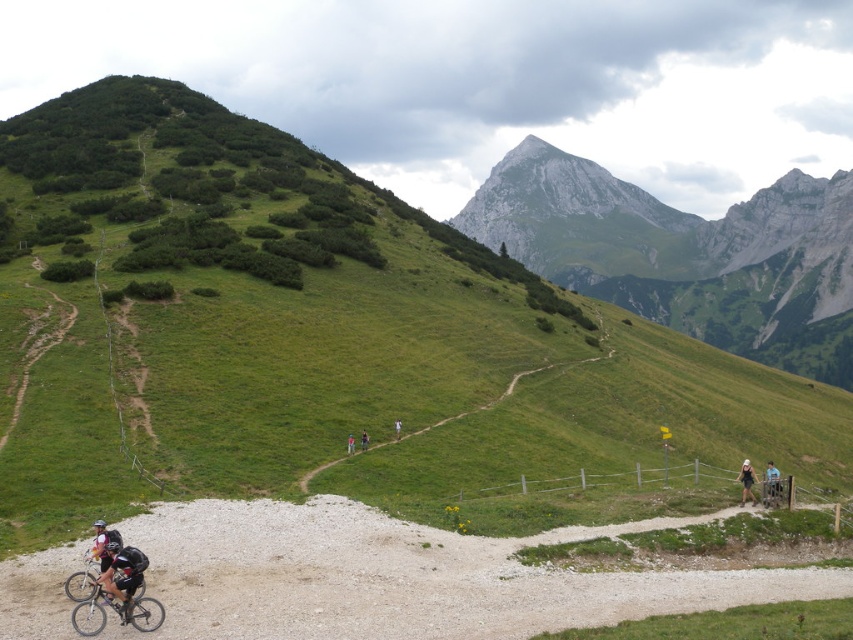
Question: Is white fabric dress at lower right to the left of pink fabric pants at center from the viewer's perspective?

Choices:
 (A) yes
 (B) no

Answer: (B)

Question: Among these points, which one is nearest to the camera?

Choices:
 (A) (743, 472)
 (B) (529, 593)
 (C) (397, 438)
 (D) (347, 451)

Answer: (B)

Question: Does black fabric backpack at lower right have a smaller size compared to pink fabric backpack at center?

Choices:
 (A) yes
 (B) no

Answer: (B)

Question: Observing the image, what is the correct spatial positioning of white matte bicycle helmet at lower left in reference to pink fabric pants at center?

Choices:
 (A) below
 (B) above

Answer: (A)

Question: Estimate the real-world distances between objects in this image. Which object is farther from the white matte bicycle helmet at lower left?

Choices:
 (A) gravelly dirt track at lower left
 (B) white fabric person at center
 (C) matte black bicycle at lower left

Answer: (B)

Question: Which object appears closest to the camera in this image?

Choices:
 (A) rugged stone mountain at upper center
 (B) black matte bicycle helmet at lower left

Answer: (B)